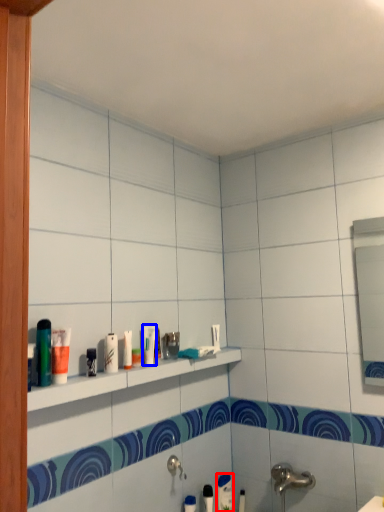
Question: Among these objects, which one is nearest to the camera, toothpaste (highlighted by a red box) or toiletry (highlighted by a blue box)?

Choices:
 (A) toothpaste
 (B) toiletry

Answer: (B)